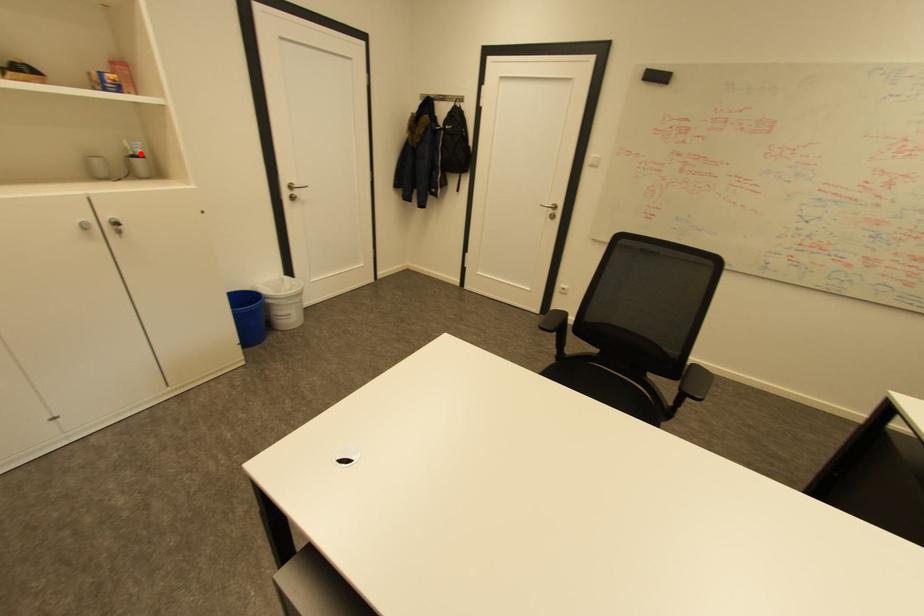
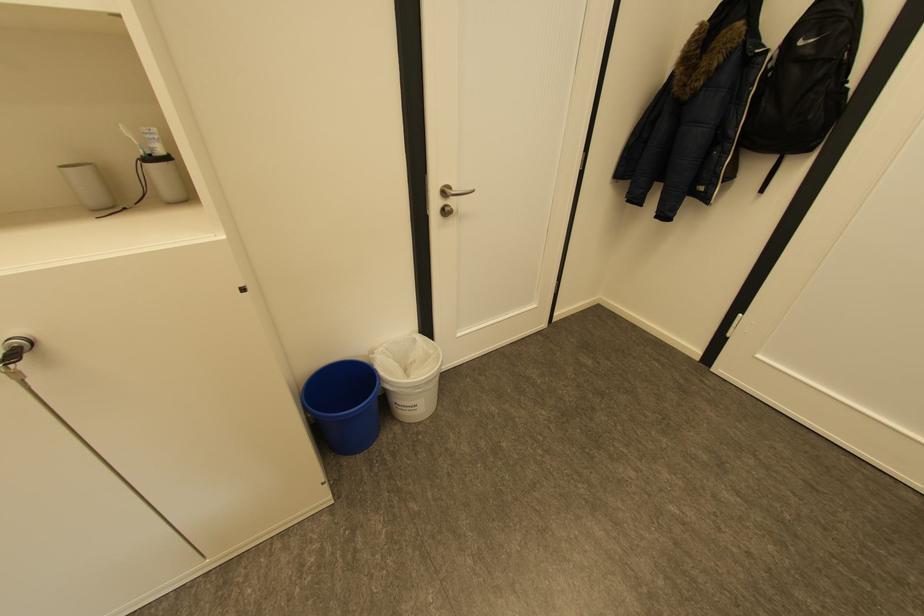
Find the pixel in the second image that matches the highlighted location in the first image.

(150, 153)